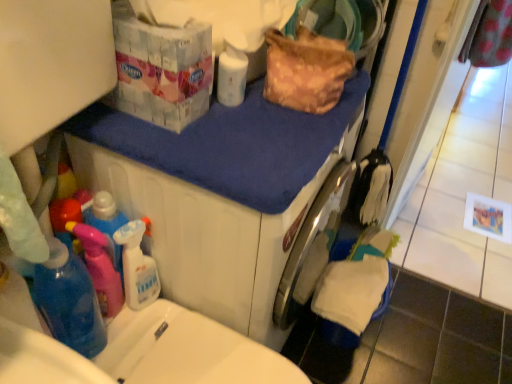
I want to click on free location in front of white glossy bottle at upper center, so click(227, 136).